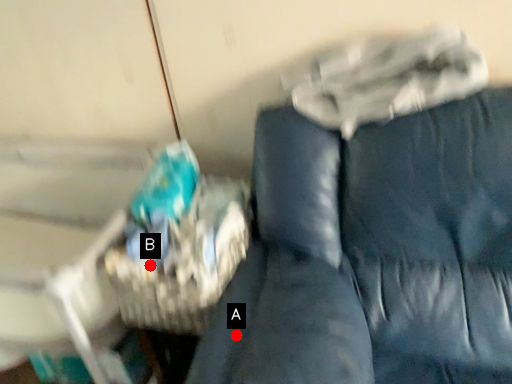
Question: Two points are circled on the image, labeled by A and B beside each circle. Which point appears farthest from the camera in this image?

Choices:
 (A) A is further
 (B) B is further

Answer: (B)